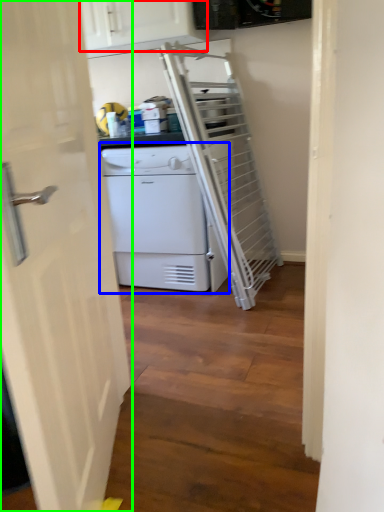
Question: Which object is positioned farthest from cabinetry (highlighted by a red box)? Select from home appliance (highlighted by a blue box) and door (highlighted by a green box).

Choices:
 (A) home appliance
 (B) door

Answer: (B)